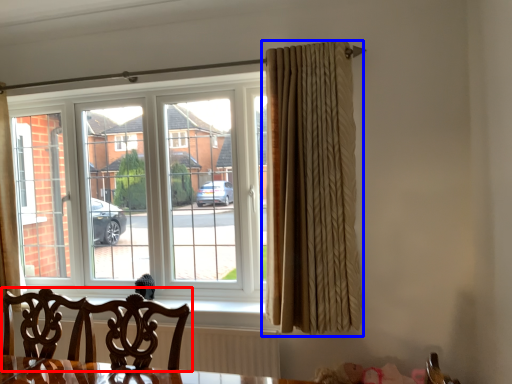
Question: Which object is further to the camera taking this photo, chair (highlighted by a red box) or curtain (highlighted by a blue box)?

Choices:
 (A) chair
 (B) curtain

Answer: (B)